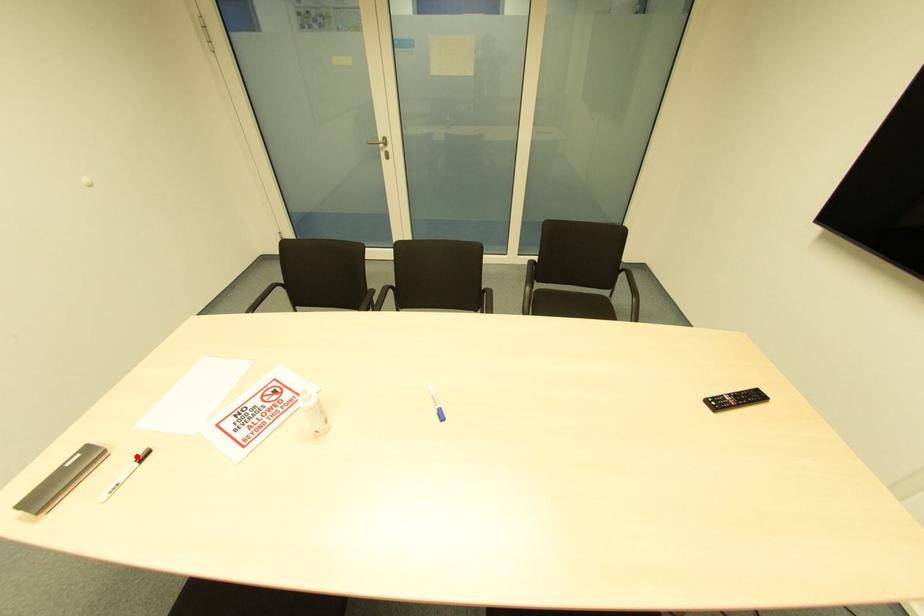
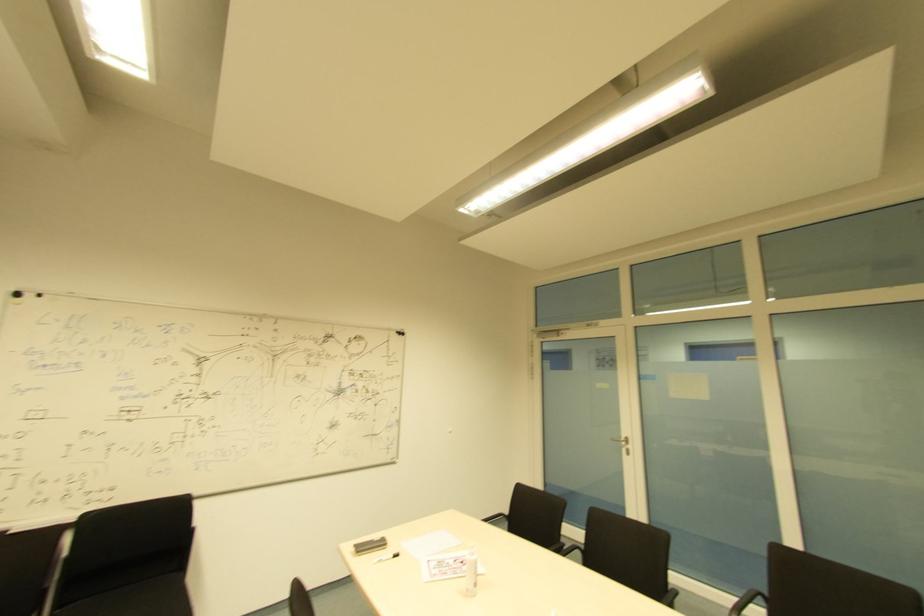
Locate, in the second image, the point that corresponds to the highlighted location in the first image.

(394, 554)